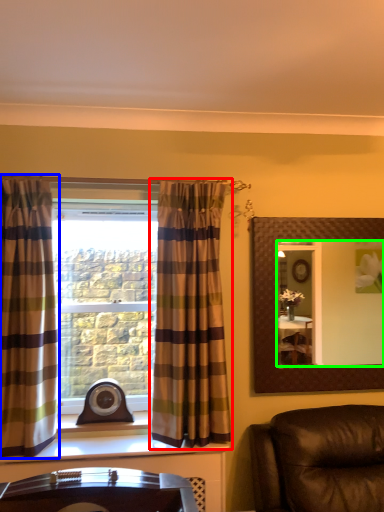
Question: Based on their relative distances, which object is farther from curtain (highlighted by a red box)? Choose from curtain (highlighted by a blue box) and mirror (highlighted by a green box).

Choices:
 (A) curtain
 (B) mirror

Answer: (B)